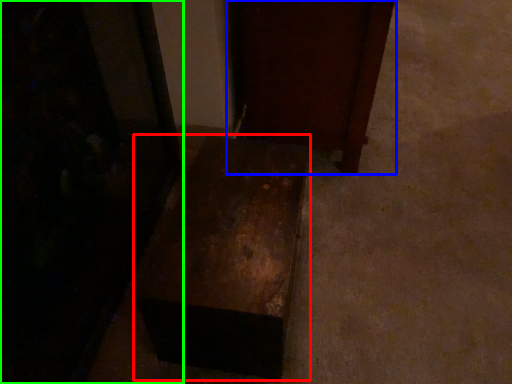
Question: Which is nearer to the furniture (highlighted by a red box)? furniture (highlighted by a blue box) or furniture (highlighted by a green box).

Choices:
 (A) furniture
 (B) furniture

Answer: (B)